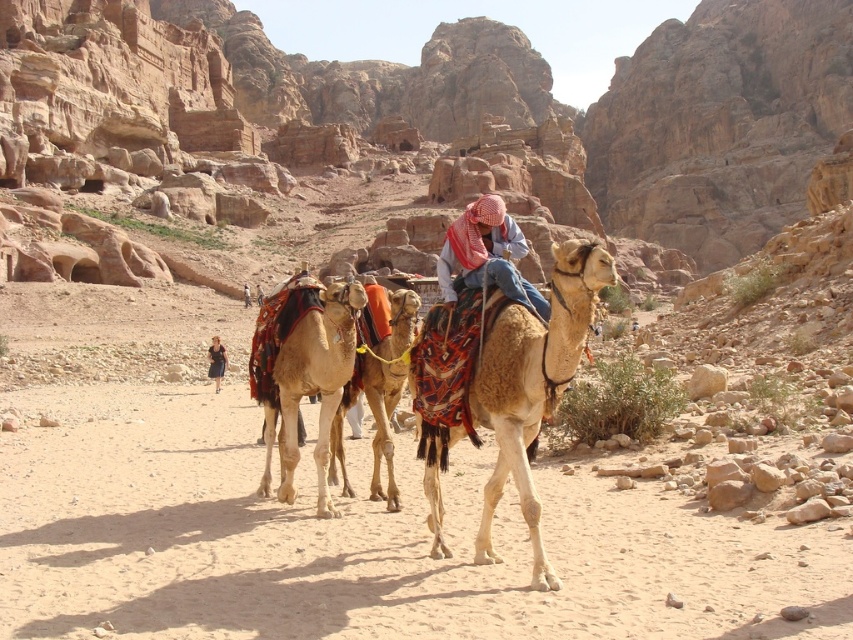
You are standing in the desert scene and want to place a small marker at each of the two points mentioned. Which point, point [221,365] or point [242,289], is closer to you?

Point [221,365] is closer to the viewer than point [242,289].

You are standing in the desert scene described. You notice a point marked at coordinates [532,385]. What object does this point indicate?

The point at coordinates [532,385] marks the brown textured camel at center.